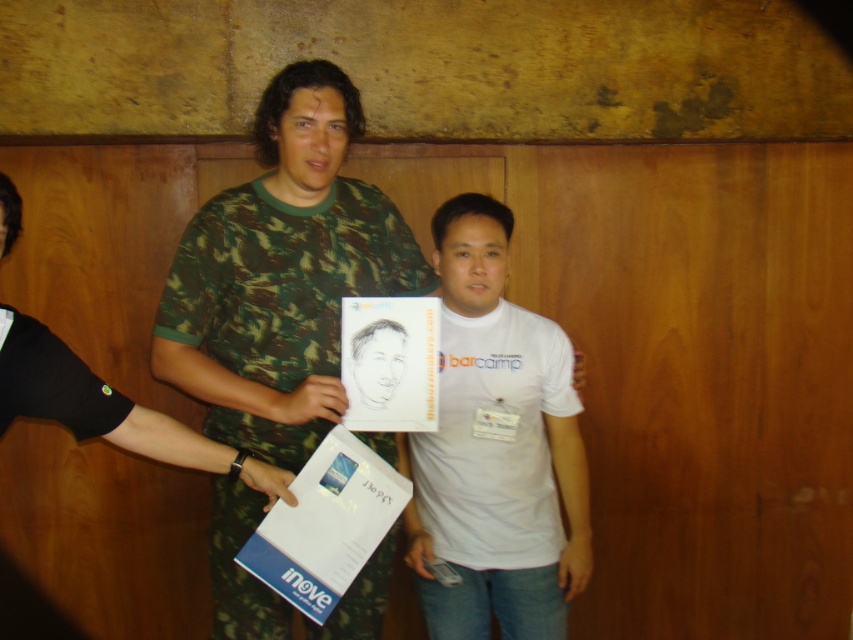
Question: Considering the real-world distances, which object is farthest from the camouflage fabric shirt at center?

Choices:
 (A) smooth paper portrait at center
 (B) white matte t-shirt at center

Answer: (B)

Question: Which is nearer to the smooth paper portrait at center?

Choices:
 (A) camo fabric shirt at center
 (B) white matte t-shirt at center
 (C) camouflage fabric shirt at center

Answer: (A)

Question: Based on their relative distances, which object is farther from the smooth paper portrait at center?

Choices:
 (A) camouflage fabric shirt at center
 (B) camo fabric shirt at center
 (C) white matte t-shirt at center

Answer: (A)

Question: Can you confirm if camouflage fabric shirt at center is positioned above smooth paper portrait at center?

Choices:
 (A) yes
 (B) no

Answer: (B)

Question: Does camo fabric shirt at center appear over smooth paper portrait at center?

Choices:
 (A) yes
 (B) no

Answer: (A)

Question: Can you confirm if white matte t-shirt at center is positioned below smooth paper portrait at center?

Choices:
 (A) no
 (B) yes

Answer: (B)